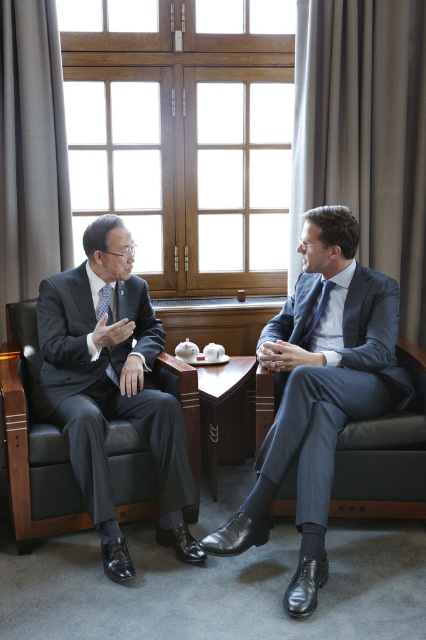
You are a photographer setting up for a professional photoshoot in the described scene. You need to ensure that the matte blue tie at center and the matte black tie at left are both visible in the frame. Based on their positions, which tie is closer to the bottom edge of the photo?

The matte blue tie at center is below the matte black tie at left, so the matte blue tie at center is closer to the bottom edge of the photo.

You are standing in the meeting room and need to find the leather armchair at left. According to the room layout, where should you look?

The leather armchair at left is located at point (34, 442) in the room layout.

In the scene shown: You are a person who needs to choose a chair to sit in for a long meeting. The leather armchair at left and the dark blue fabric armchair at right are available. Based on their sizes, which chair would be more comfortable for a long period?

The leather armchair at left is wider than the dark blue fabric armchair at right, so it would be more comfortable for a long meeting.